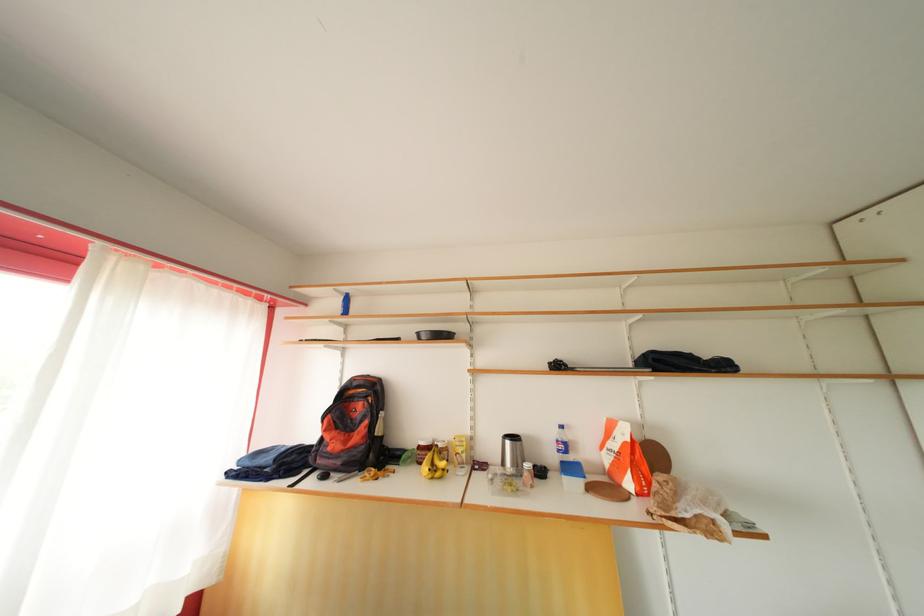
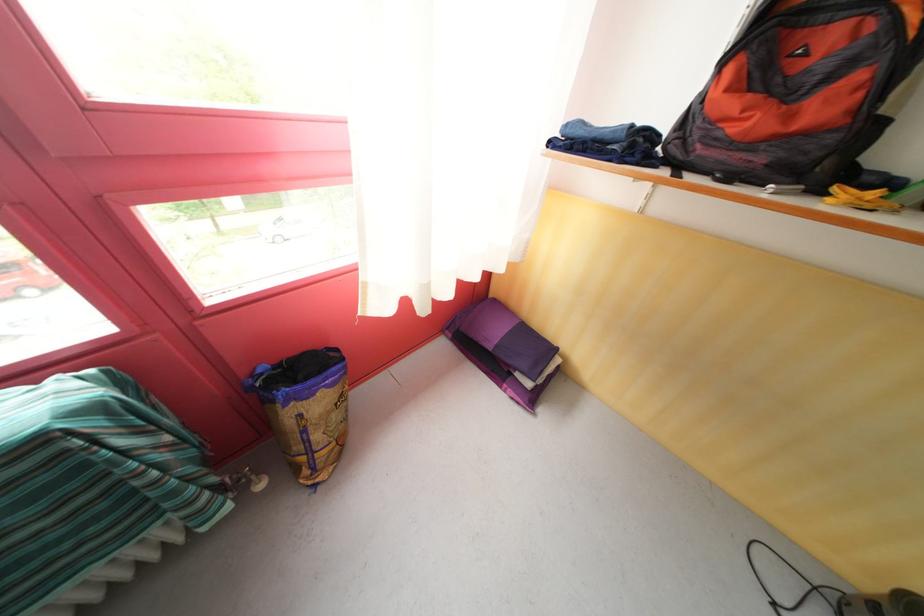
The first image is from the beginning of the video and the second image is from the end. How did the camera likely rotate when shooting the video?

The rotation direction of the camera is left-down.